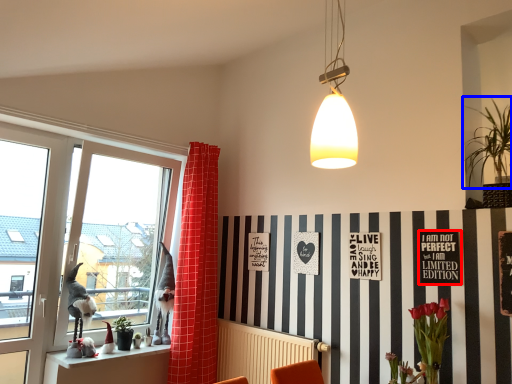
Question: Among these objects, which one is farthest to the camera, bulletin board (highlighted by a red box) or plant (highlighted by a blue box)?

Choices:
 (A) bulletin board
 (B) plant

Answer: (A)